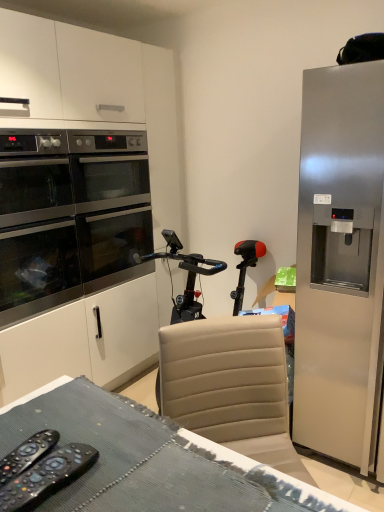
Locate an element on the screen. This screenshot has height=512, width=384. vacant area that lies to the right of black plastic remote controls at lower left, which ranks as the 2th remote control in left-to-right order is located at coordinates (139, 473).